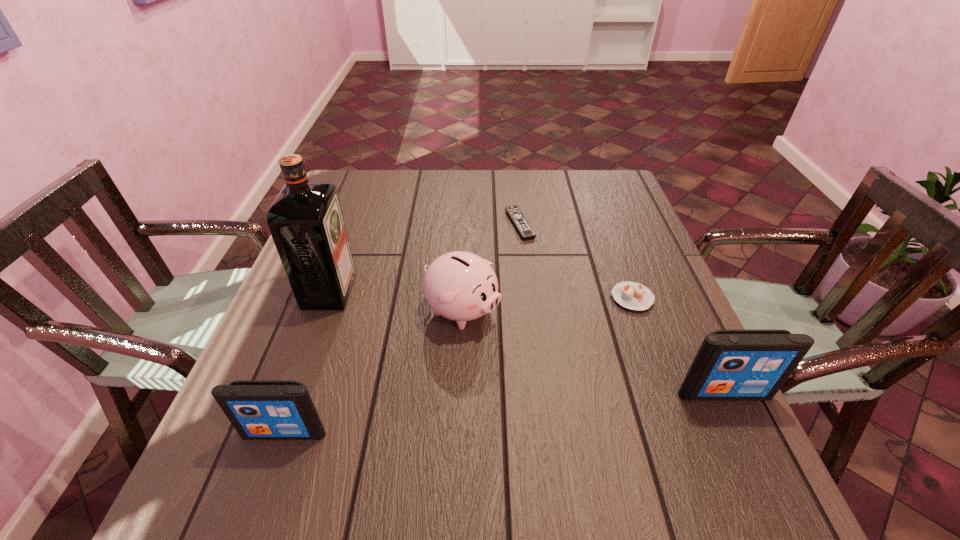
You are a GUI agent. You are given a task and a screenshot of the screen. Output one action in this format:
    pyautogui.click(x=<x>, y=<y>)
    Task: Click on the vacant space at the far edge
    
    Given the screenshot: What is the action you would take?
    pyautogui.click(x=384, y=199)

This screenshot has height=540, width=960. I want to click on vacant space at the near edge of the desktop, so click(444, 434).

Find the location of `blank space at the right edge of the desktop`. blank space at the right edge of the desktop is located at coordinates (623, 319).

The width and height of the screenshot is (960, 540). I want to click on blank space at the far left corner of the desktop, so click(x=385, y=178).

At what (x,y) coordinates should I click in order to perform the action: click on vacant space at the far right corner of the desktop. Please return your answer as a coordinate pair (x, y). This screenshot has width=960, height=540. Looking at the image, I should click on (602, 174).

Where is `blank region between the nearer iPod and the piggy bank`? blank region between the nearer iPod and the piggy bank is located at coordinates (373, 372).

The width and height of the screenshot is (960, 540). What are the coordinates of `free space between the nearest object and the shortest object` in the screenshot? It's located at tap(402, 328).

I want to click on free space that is in between the tallest object and the remote control, so click(x=424, y=258).

Identify the location of free space between the shortest object and the tallest object. The height and width of the screenshot is (540, 960). (424, 258).

The image size is (960, 540). I want to click on vacant point located between the tallest object and the shortest object, so click(x=424, y=258).